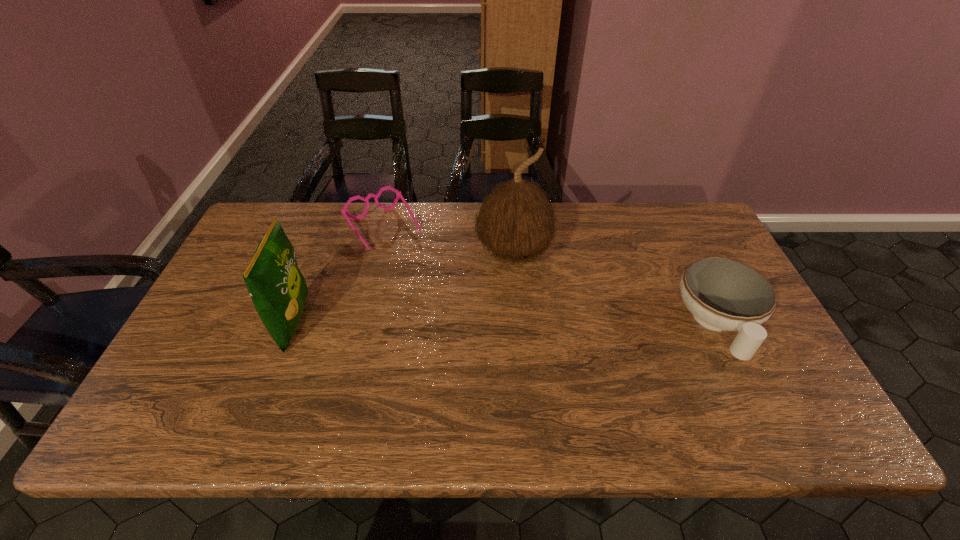
Find the location of a particular element. Image resolution: width=960 pixels, height=540 pixels. free spot on the desktop that is between the second tallest object and the third tallest object and is positioned on the surface of the tallest object is located at coordinates (555, 324).

Where is `vacant space on the desktop that is between the third shortest object and the third tallest object and is positioned on the arms of the shortest object`? vacant space on the desktop that is between the third shortest object and the third tallest object and is positioned on the arms of the shortest object is located at coordinates (448, 323).